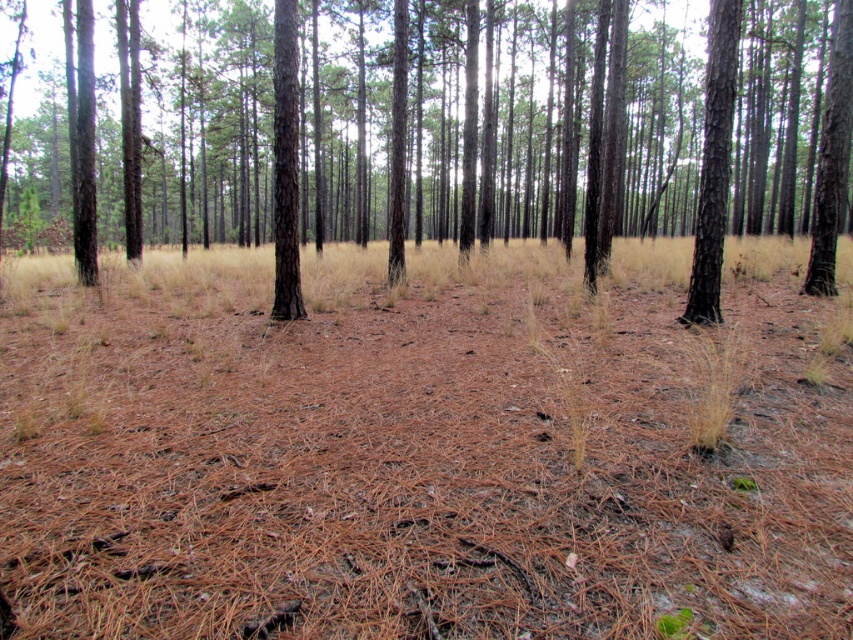
You are a hiker trying to determine the best path through the forest. You notice two trees ahead of you. The smooth brown tree trunk at right and the smooth brown tree at center. Which tree has a thicker trunk?

The smooth brown tree at center has a thicker trunk than the smooth brown tree trunk at right.